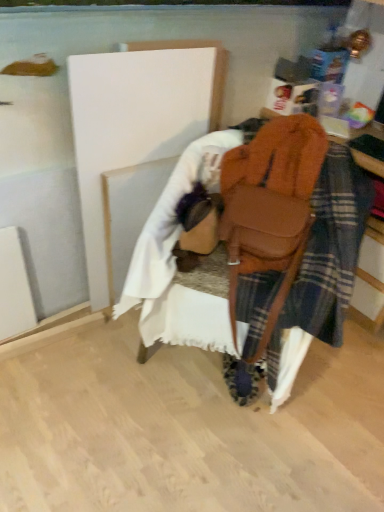
Question: From a real-world perspective, is white painted wood at center, acting as the second wood starting from the bottom, located higher than white fabric at lower center, marked as the second wood in a top-to-bottom arrangement?

Choices:
 (A) yes
 (B) no

Answer: (A)

Question: Does white painted wood at center, acting as the second wood starting from the bottom, turn towards white fabric at lower center, marked as the second wood in a top-to-bottom arrangement?

Choices:
 (A) yes
 (B) no

Answer: (A)

Question: Can you confirm if white painted wood at center, positioned as the first wood in top-to-bottom order, is bigger than white fabric at lower center, marked as the second wood in a top-to-bottom arrangement?

Choices:
 (A) yes
 (B) no

Answer: (A)

Question: From the image's perspective, is white painted wood at center, acting as the second wood starting from the bottom, under white fabric at lower center, marked as the second wood in a top-to-bottom arrangement?

Choices:
 (A) no
 (B) yes

Answer: (A)

Question: Is white painted wood at center, positioned as the first wood in top-to-bottom order, at the left side of white fabric at lower center, marked as the second wood in a top-to-bottom arrangement?

Choices:
 (A) no
 (B) yes

Answer: (A)

Question: From the image's perspective, relative to white fabric at lower center, marked as the second wood in a top-to-bottom arrangement, is white painted wood at center, positioned as the first wood in top-to-bottom order, above or below?

Choices:
 (A) below
 (B) above

Answer: (B)

Question: Is point (117, 92) positioned closer to the camera than point (139, 201)?

Choices:
 (A) closer
 (B) farther

Answer: (A)

Question: From a real-world perspective, is white painted wood at center, acting as the second wood starting from the bottom, positioned above or below white fabric at lower center, which appears as the first wood when ordered from the bottom?

Choices:
 (A) above
 (B) below

Answer: (A)

Question: Considering their positions, is white painted wood at center, positioned as the first wood in top-to-bottom order, located in front of or behind white fabric at lower center, marked as the second wood in a top-to-bottom arrangement?

Choices:
 (A) front
 (B) behind

Answer: (A)

Question: From the image's perspective, is brown leather bag at center above or below white painted wood at center, acting as the second wood starting from the bottom?

Choices:
 (A) above
 (B) below

Answer: (B)

Question: Looking at their shapes, would you say brown leather bag at center is wider or thinner than white painted wood at center, acting as the second wood starting from the bottom?

Choices:
 (A) thin
 (B) wide

Answer: (B)

Question: From their relative heights in the image, would you say brown leather bag at center is taller or shorter than white painted wood at center, positioned as the first wood in top-to-bottom order?

Choices:
 (A) short
 (B) tall

Answer: (A)

Question: Visually, is brown leather bag at center positioned to the left or to the right of white painted wood at center, acting as the second wood starting from the bottom?

Choices:
 (A) right
 (B) left

Answer: (A)

Question: Is point (104, 56) closer or farther from the camera than point (302, 146)?

Choices:
 (A) farther
 (B) closer

Answer: (B)

Question: From the image's perspective, is white painted wood at center, positioned as the first wood in top-to-bottom order, positioned above or below brown leather bag at center?

Choices:
 (A) above
 (B) below

Answer: (A)